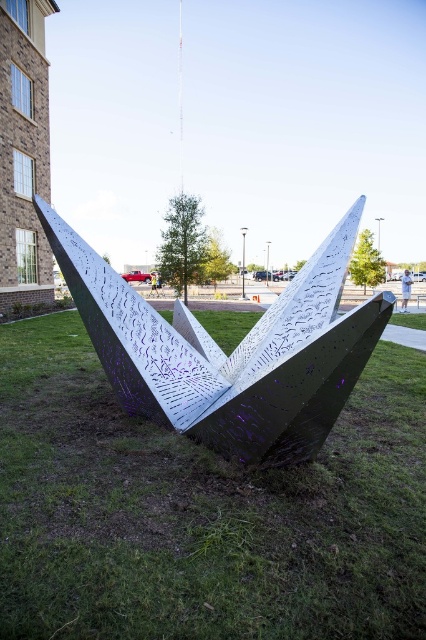
You are standing in the grassy area and want to take a photo of the metallic silver sculpture at center without any obstructions. Since the metallic grass at center is in front of the sculpture, will the grass block your view of the sculpture?

The metallic grass at center has a lesser height compared to the metallic silver sculpture at center, so the grass will not block your view of the sculpture as it is shorter than the sculpture.